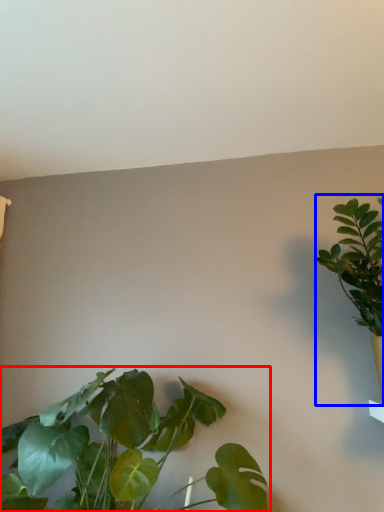
Question: Which object appears farthest to the camera in this image, houseplant (highlighted by a red box) or houseplant (highlighted by a blue box)?

Choices:
 (A) houseplant
 (B) houseplant

Answer: (B)